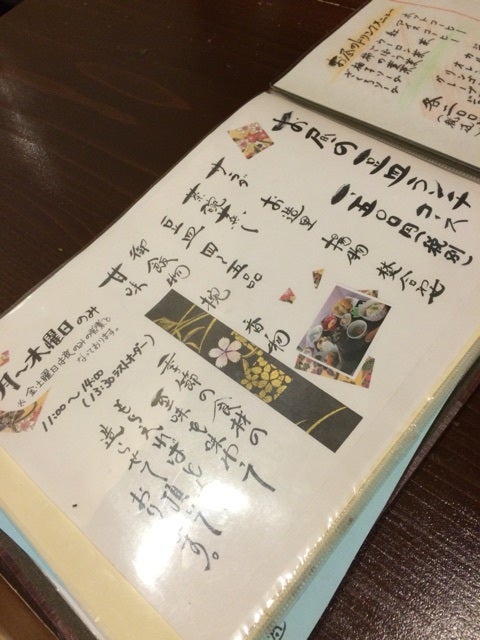
You are a GUI agent. You are given a task and a screenshot of the screen. Output one action in this format:
    pyautogui.click(x=<x>, y=<y>)
    Task: Click on the table
    The image size is (480, 640).
    Given the screenshot: What is the action you would take?
    pyautogui.click(x=147, y=88), pyautogui.click(x=415, y=554)